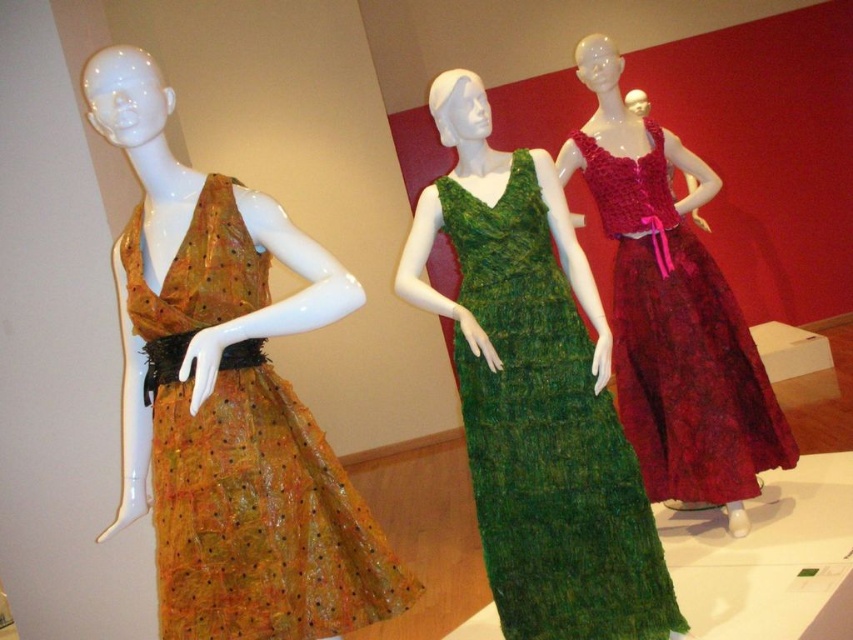
Is green knitted dress at center positioned at the back of velvet-like burgundy dress at right?

No.

Does green knitted dress at center have a lesser height compared to velvet-like burgundy dress at right?

Yes.

Describe the element at coordinates (546, 436) in the screenshot. This screenshot has width=853, height=640. I see `green knitted dress at center` at that location.

Where is `green knitted dress at center`? The image size is (853, 640). green knitted dress at center is located at coordinates (546, 436).

Between translucent orange dress at left and green knitted dress at center, which one is positioned lower?

translucent orange dress at left

Does translucent orange dress at left come behind green knitted dress at center?

No.

The width and height of the screenshot is (853, 640). What are the coordinates of `translucent orange dress at left` in the screenshot? It's located at (244, 461).

Find the location of `translucent orange dress at left`. translucent orange dress at left is located at coordinates (244, 461).

The width and height of the screenshot is (853, 640). What are the coordinates of `translucent orange dress at left` in the screenshot? It's located at (244, 461).

What do you see at coordinates (244, 461) in the screenshot? The width and height of the screenshot is (853, 640). I see `translucent orange dress at left` at bounding box center [244, 461].

Is point (395, 595) positioned after point (670, 248)?

No, (395, 595) is in front of (670, 248).

Image resolution: width=853 pixels, height=640 pixels. What are the coordinates of `translucent orange dress at left` in the screenshot? It's located at (244, 461).